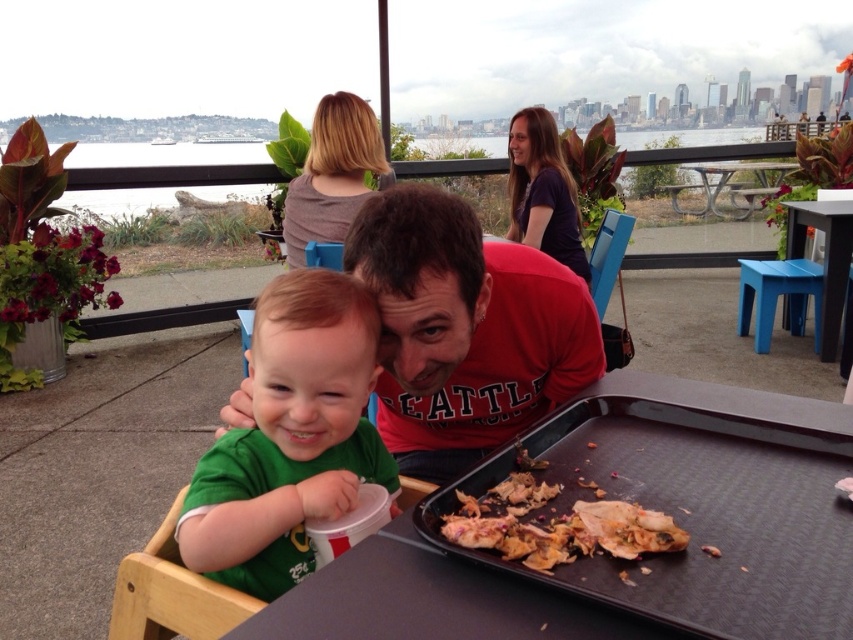
Is black plastic tray at center thinner than blue plastic stool at right?

Incorrect, black plastic tray at center's width is not less than blue plastic stool at right's.

Is black plastic tray at center positioned before blue plastic stool at right?

Yes.

You are a GUI agent. You are given a task and a screenshot of the screen. Output one action in this format:
    pyautogui.click(x=<x>, y=<y>)
    Task: Click on the black plastic tray at center
    This screenshot has width=853, height=640.
    Given the screenshot: What is the action you would take?
    pyautogui.click(x=618, y=560)

Is black plastic tray at center further to camera compared to red matte shirt at center?

No, it is in front of red matte shirt at center.

Which is behind, point (654, 451) or point (428, 234)?

Positioned behind is point (654, 451).

Is point (457, 547) less distant than point (479, 257)?

Yes, it is in front of point (479, 257).

At what (x,y) coordinates should I click in order to perform the action: click on black plastic tray at center. Please return your answer as a coordinate pair (x, y). This screenshot has width=853, height=640. Looking at the image, I should click on (618, 560).

Between black plastic tray at center and black plastic table at center, which one is positioned lower?

Positioned lower is black plastic tray at center.

Who is more distant from viewer, (321, 632) or (848, 262)?

The point (848, 262) is more distant.

The width and height of the screenshot is (853, 640). In order to click on black plastic tray at center in this screenshot , I will do `click(618, 560)`.